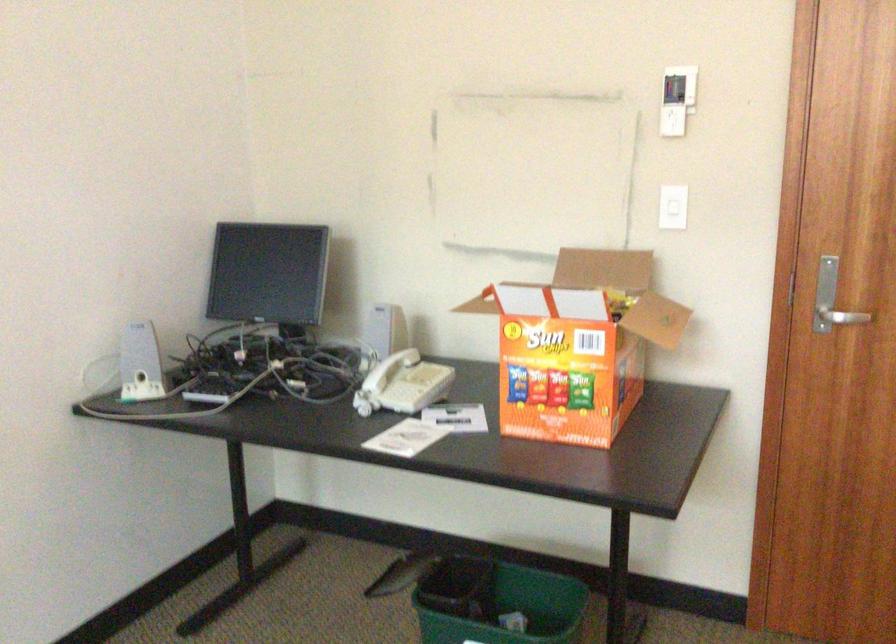
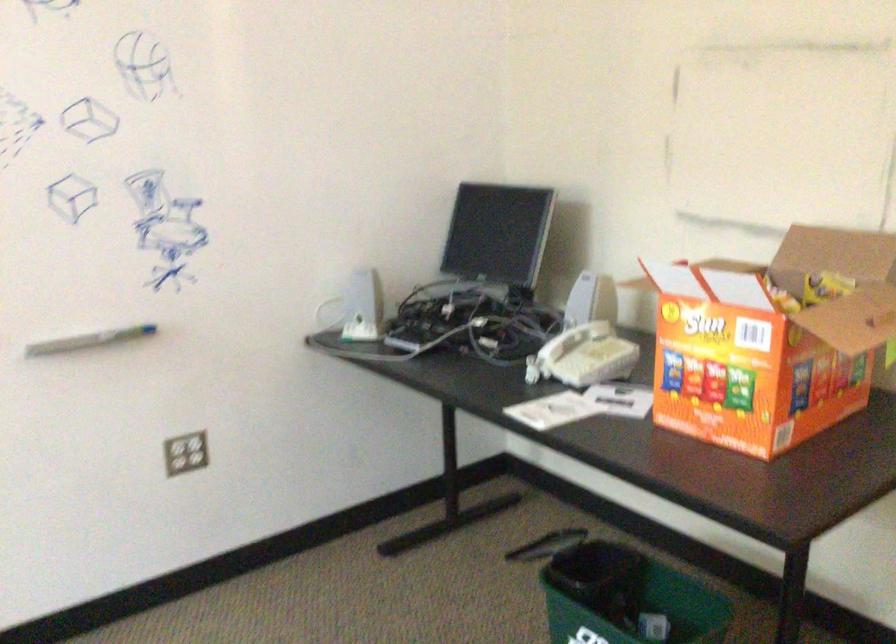
The point at (385, 375) is marked in the first image. Where is the corresponding point in the second image?

(558, 345)